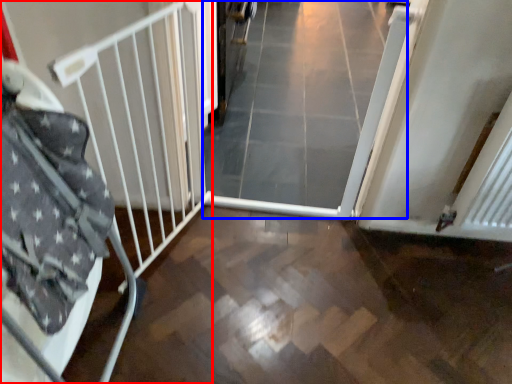
Question: Among these objects, which one is farthest to the camera, bed frame (highlighted by a red box) or plain (highlighted by a blue box)?

Choices:
 (A) bed frame
 (B) plain

Answer: (B)